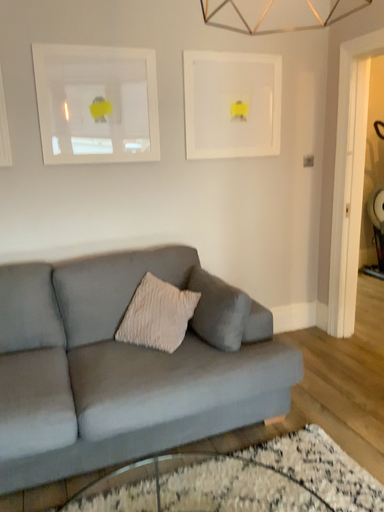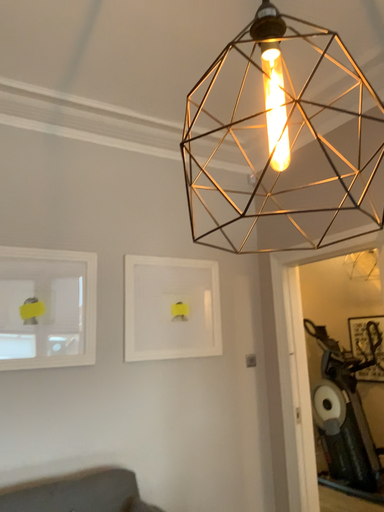
Question: Which way did the camera rotate in the video?

Choices:
 (A) rotated downward
 (B) rotated upward

Answer: (B)